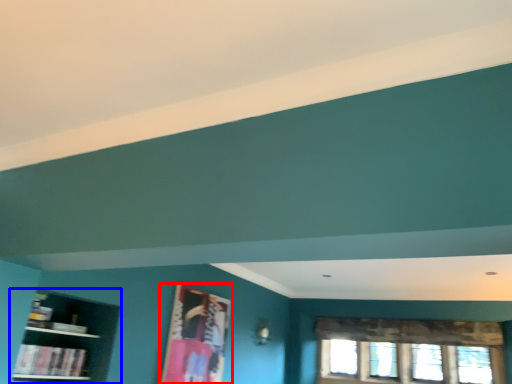
Question: Which point is closer to the camera, picture frame (highlighted by a red box) or shelf (highlighted by a blue box)?

Choices:
 (A) picture frame
 (B) shelf

Answer: (B)